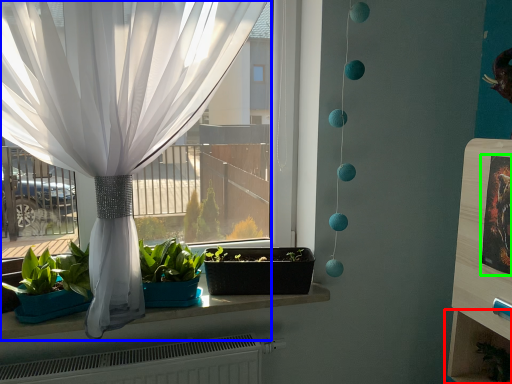
Question: Based on their relative distances, which object is farther from shelf (highlighted by a red box)? Choose from curtain (highlighted by a blue box) and picture frame (highlighted by a green box).

Choices:
 (A) curtain
 (B) picture frame

Answer: (A)